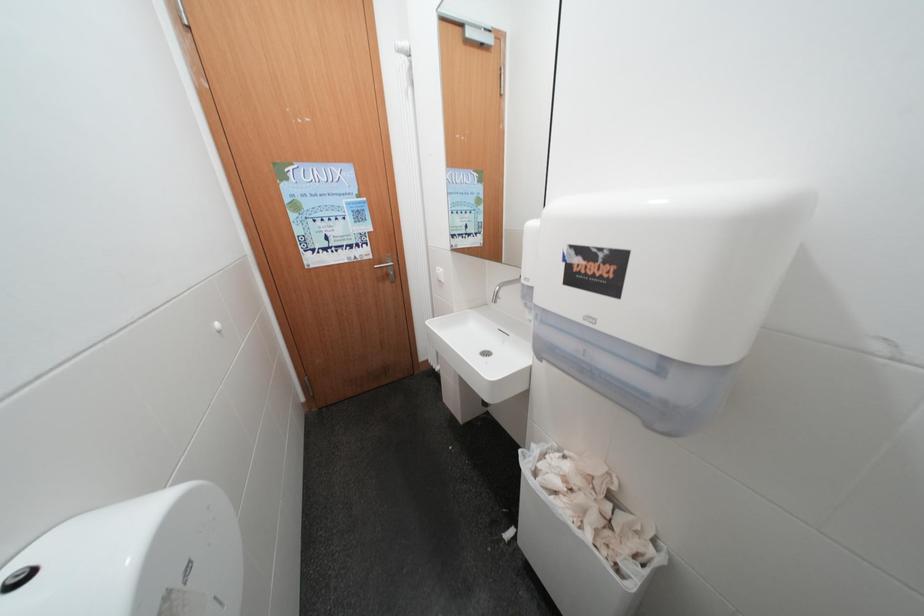
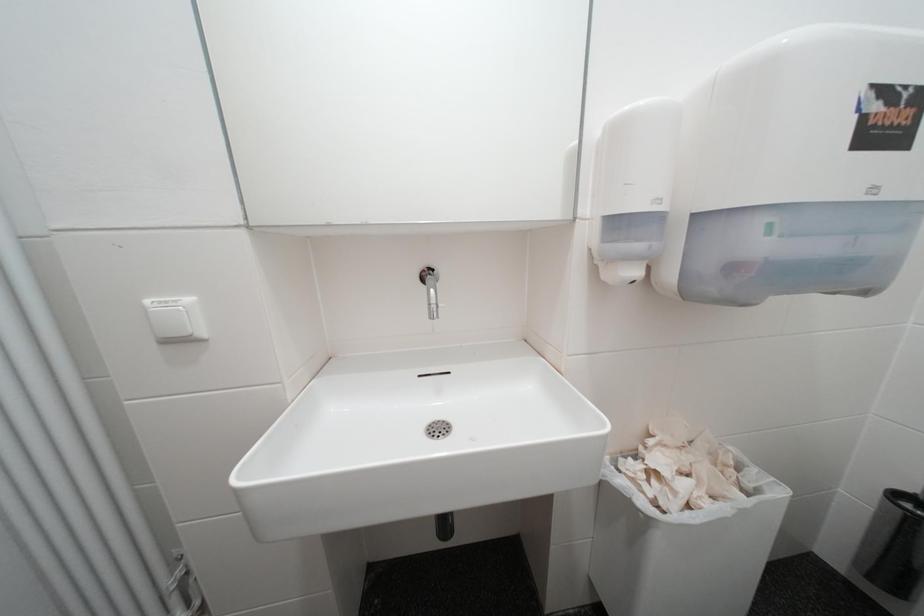
Question: Based on the continuous images, in which direction is the camera rotating? Reply with the corresponding letter.

Choices:
 (A) Left
 (B) Right
 (C) Up
 (D) Down

Answer: (B)